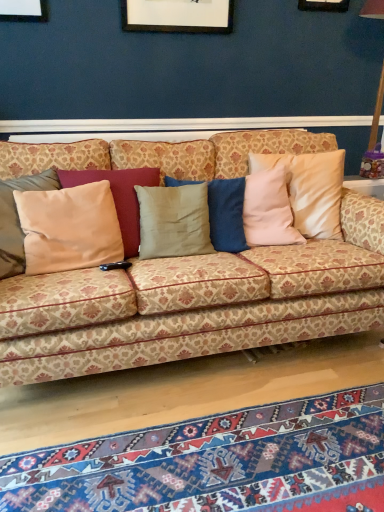
I want to click on free point above textured wool mat at lower center (from a real-world perspective), so click(x=231, y=460).